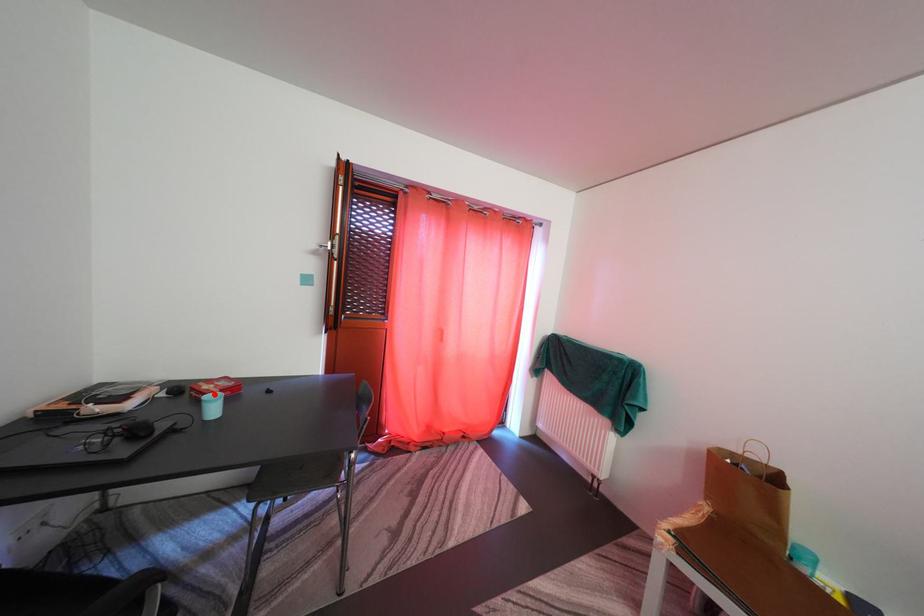
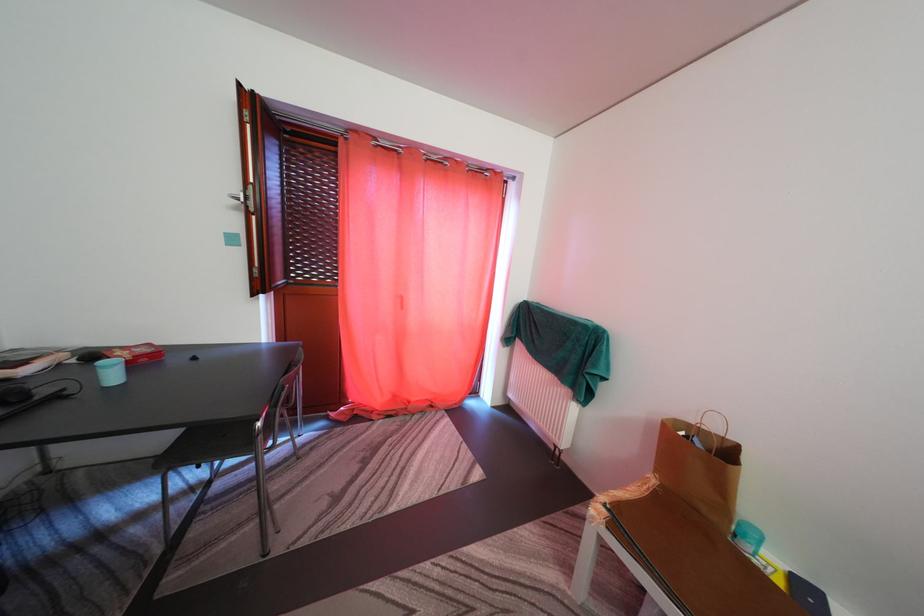
Where in the second image is the point corresponding to the highlighted location from the first image?

(128, 360)